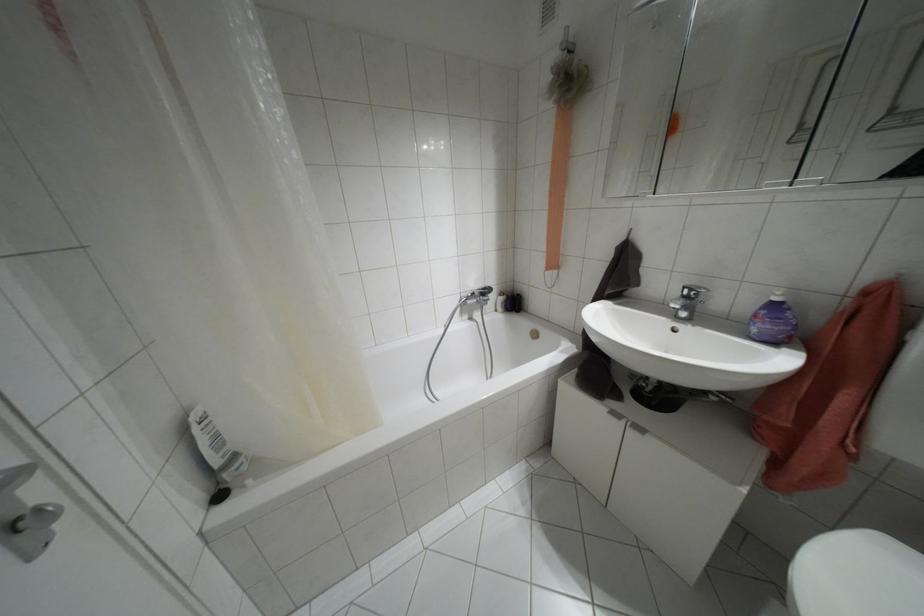
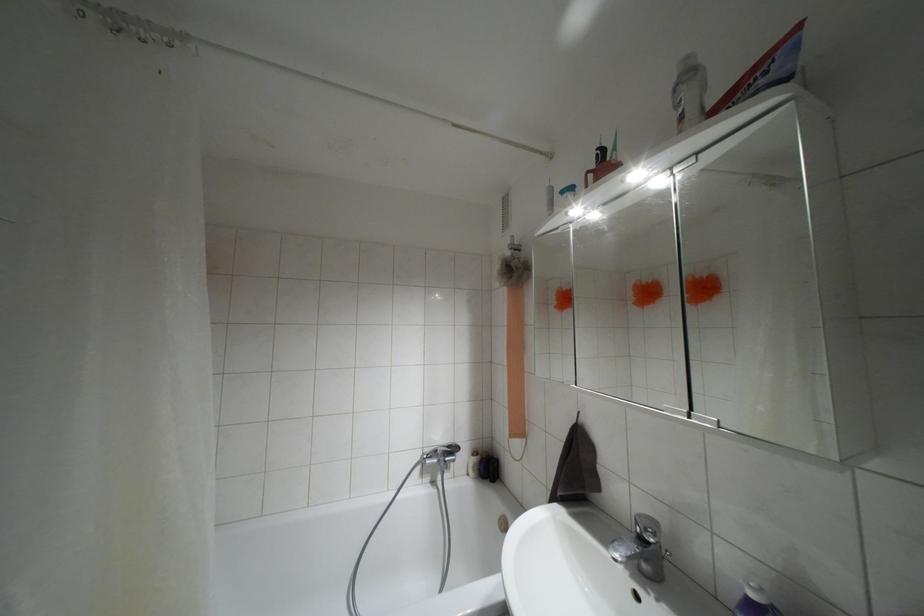
Where in the second image is the point corresponding to (x=566, y=90) from the first image?

(509, 277)